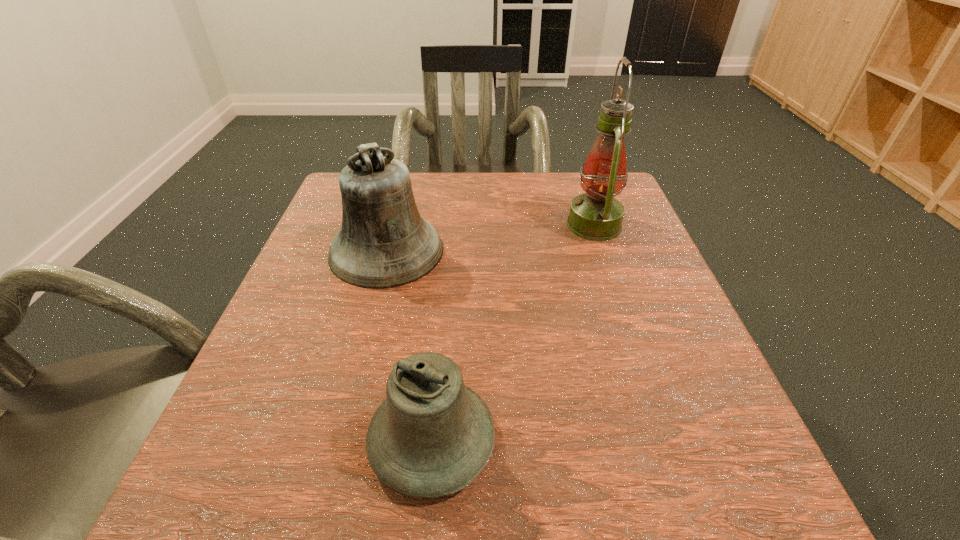
The image size is (960, 540). What are the coordinates of `oil lamp` in the screenshot? It's located at (596, 215).

Where is `the rightmost object`? The height and width of the screenshot is (540, 960). the rightmost object is located at coordinates (596, 215).

Where is `the taller bell`? the taller bell is located at coordinates (383, 243).

What are the coordinates of `the farther bell` in the screenshot? It's located at (383, 243).

This screenshot has height=540, width=960. Find the location of `the nearest object`. the nearest object is located at coordinates point(432,436).

Image resolution: width=960 pixels, height=540 pixels. In order to click on the shortest object in this screenshot , I will do `click(432, 436)`.

The image size is (960, 540). Identify the location of vacant space situated on the back of the oil lamp. (583, 193).

In order to click on free spot located 0.280m on the front of the farther bell in this screenshot , I will do `click(341, 426)`.

Where is `free space located 0.160m on the right of the nearer bell`? The height and width of the screenshot is (540, 960). free space located 0.160m on the right of the nearer bell is located at coordinates tap(613, 440).

Locate an element on the screen. The height and width of the screenshot is (540, 960). oil lamp that is at the far edge is located at coordinates (596, 215).